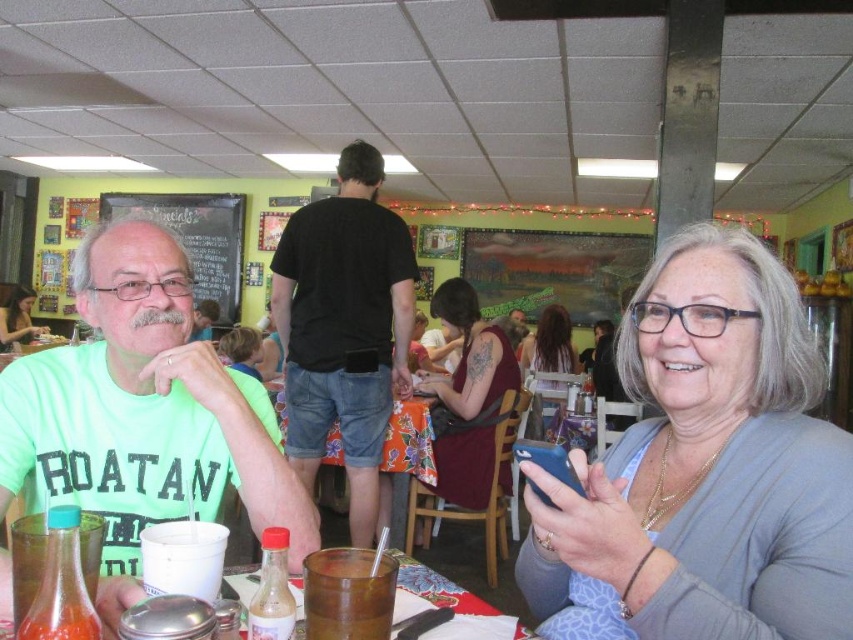
Question: Which point is farther to the camera?

Choices:
 (A) (221, 316)
 (B) (440, 396)
 (C) (322, 252)

Answer: (A)

Question: Is matte black phone at center further to the viewer compared to smooth brown hair at center?

Choices:
 (A) yes
 (B) no

Answer: (A)

Question: Which point is closer to the camera?

Choices:
 (A) gray fabric shirt at center
 (B) green t-shirt at left
 (C) neon green t-shirt at left

Answer: (A)

Question: Does translucent plastic cup at lower center have a smaller size compared to smooth brown hair at center?

Choices:
 (A) yes
 (B) no

Answer: (A)

Question: Does maroon fabric dress at center appear on the left side of smooth brown hair at center?

Choices:
 (A) no
 (B) yes

Answer: (A)

Question: Which of the following is the farthest from the observer?

Choices:
 (A) (241, 330)
 (B) (471, 349)
 (C) (16, 301)
 (D) (111, 193)

Answer: (D)